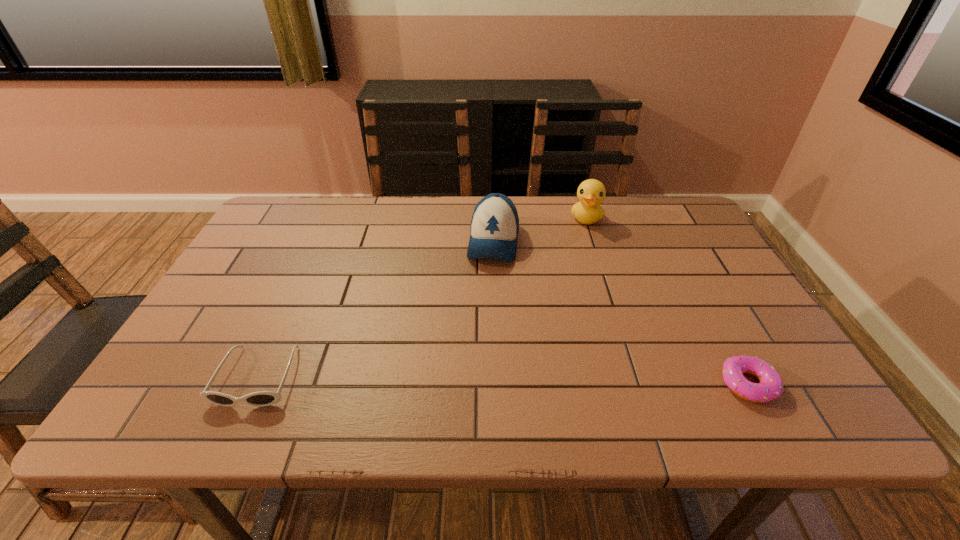
Image resolution: width=960 pixels, height=540 pixels. I want to click on free space on the desktop that is between the sunglasses and the doughnut and is positioned on the front-facing side of the third object from right to left, so click(x=472, y=380).

Image resolution: width=960 pixels, height=540 pixels. Identify the location of free spot on the desktop that is between the leftmost object and the doughnut and is positioned on the face of the second object from right to left. (561, 382).